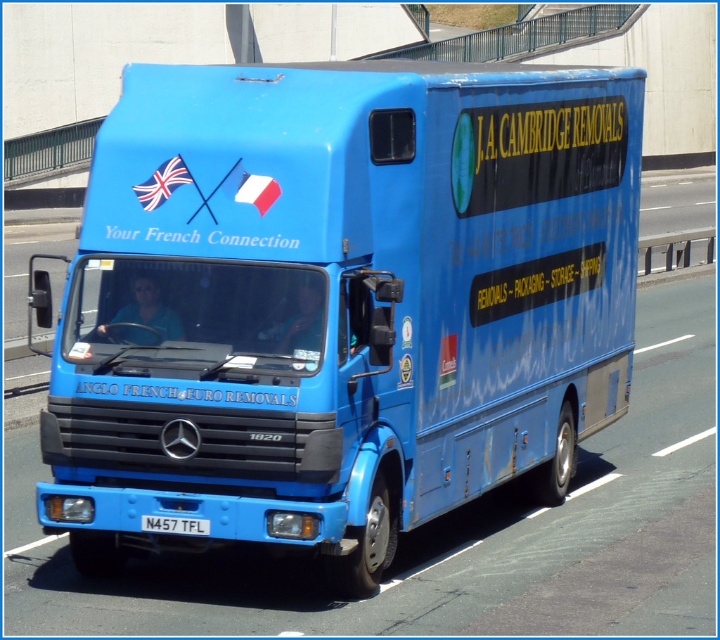
Is blue matte truck at center below blue metallic license plate at bottom?

Indeed, blue matte truck at center is positioned under blue metallic license plate at bottom.

Which is above, blue matte truck at center or blue metallic license plate at bottom?

blue metallic license plate at bottom

This screenshot has width=720, height=640. Identify the location of blue matte truck at center. click(342, 304).

Can you confirm if blue matte truck at center is taller than blue fabric flag at center?

Indeed, blue matte truck at center has a greater height compared to blue fabric flag at center.

Who is shorter, blue matte truck at center or blue fabric flag at center?

With less height is blue fabric flag at center.

Where is `blue matte truck at center`? The width and height of the screenshot is (720, 640). blue matte truck at center is located at coordinates pos(342,304).

Is blue fabric flag at center taller than blue metallic license plate at bottom?

Correct, blue fabric flag at center is much taller as blue metallic license plate at bottom.

Which is more to the right, blue fabric flag at center or blue metallic license plate at bottom?

Positioned to the right is blue fabric flag at center.

This screenshot has width=720, height=640. What do you see at coordinates (256, 192) in the screenshot?
I see `blue fabric flag at center` at bounding box center [256, 192].

The width and height of the screenshot is (720, 640). Find the location of `blue fabric flag at center`. blue fabric flag at center is located at coordinates (256, 192).